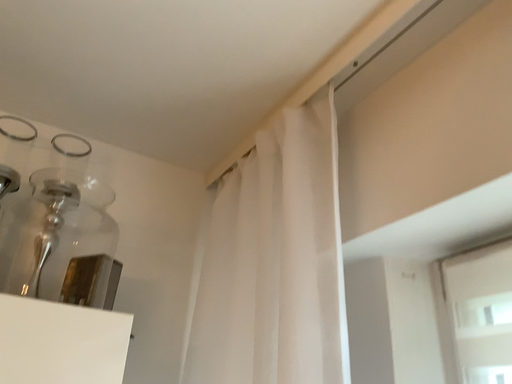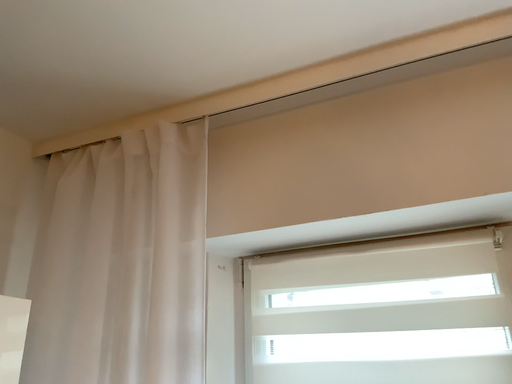
Question: How did the camera likely rotate when shooting the video?

Choices:
 (A) rotated right
 (B) rotated left

Answer: (A)